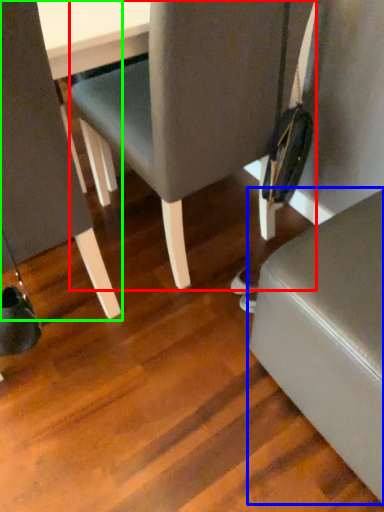
Question: Based on their relative distances, which object is nearer to chair (highlighted by a red box)? Choose from furniture (highlighted by a blue box) and chair (highlighted by a green box).

Choices:
 (A) furniture
 (B) chair

Answer: (B)